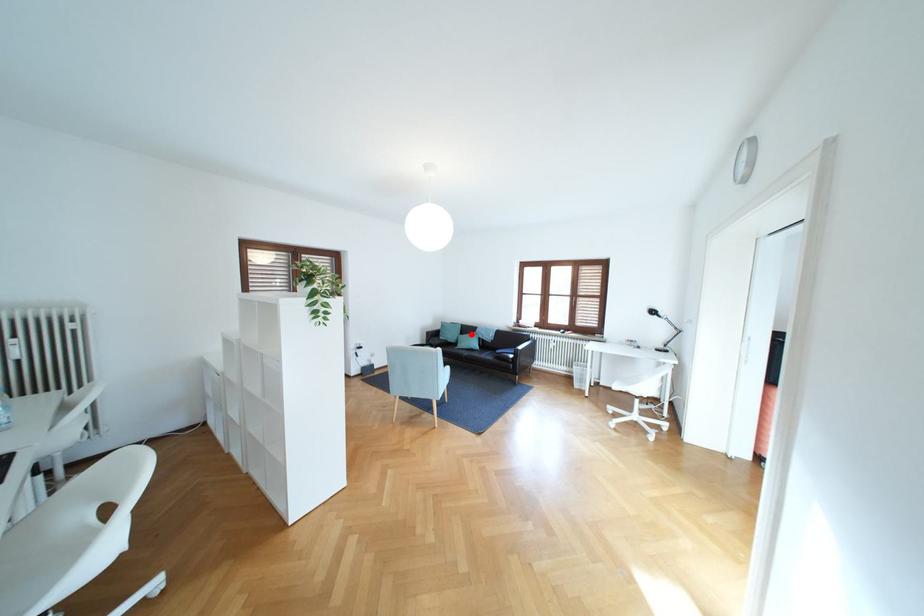
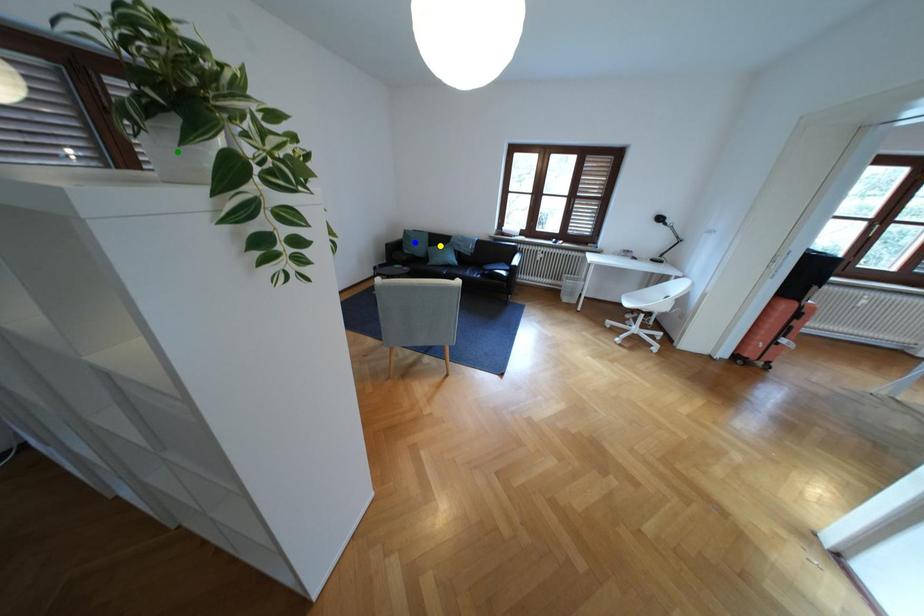
Question: I am providing you with two images of the same scene from different viewpoints. A red point is marked on the first image. You are given multiple points on the second image. Which point in image 2 is actually the same real-world point as the red point in image 1?

Choices:
 (A) green point
 (B) blue point
 (C) yellow point

Answer: (C)